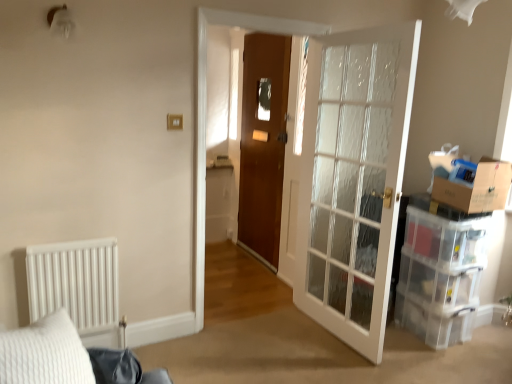
Question: Does white matte radiator at left have a larger size compared to wooden door at center?

Choices:
 (A) yes
 (B) no

Answer: (B)

Question: Is white matte radiator at left with wooden door at center?

Choices:
 (A) no
 (B) yes

Answer: (A)

Question: Considering the relative sizes of white matte radiator at left and wooden door at center in the image provided, is white matte radiator at left taller than wooden door at center?

Choices:
 (A) no
 (B) yes

Answer: (A)

Question: Is white matte radiator at left at the left side of wooden door at center?

Choices:
 (A) no
 (B) yes

Answer: (B)

Question: Is white matte radiator at left not near wooden door at center?

Choices:
 (A) yes
 (B) no

Answer: (A)

Question: From the image's perspective, does white matte radiator at left appear lower than wooden door at center?

Choices:
 (A) no
 (B) yes

Answer: (B)

Question: Is brown cardboard box at right outside clear glass door at right?

Choices:
 (A) no
 (B) yes

Answer: (B)

Question: Is brown cardboard box at right further to the viewer compared to clear glass door at right?

Choices:
 (A) no
 (B) yes

Answer: (B)

Question: Can you confirm if brown cardboard box at right is wider than clear glass door at right?

Choices:
 (A) no
 (B) yes

Answer: (B)

Question: From a real-world perspective, is brown cardboard box at right physically above clear glass door at right?

Choices:
 (A) yes
 (B) no

Answer: (A)

Question: From the image's perspective, is brown cardboard box at right below clear glass door at right?

Choices:
 (A) no
 (B) yes

Answer: (A)

Question: Can you confirm if brown cardboard box at right is shorter than clear glass door at right?

Choices:
 (A) no
 (B) yes

Answer: (B)

Question: From a real-world perspective, is clear glass door at right on brown cardboard box at right?

Choices:
 (A) yes
 (B) no

Answer: (B)